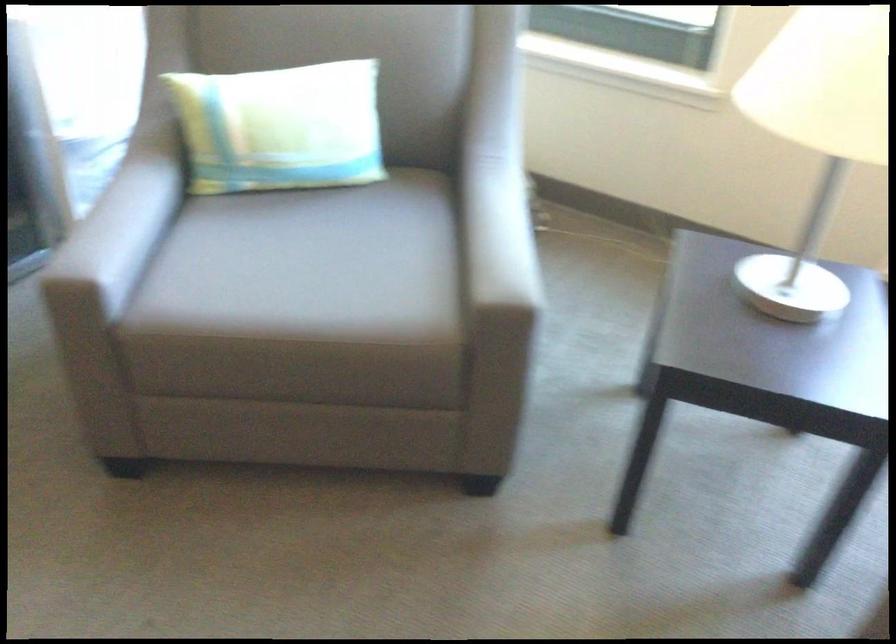
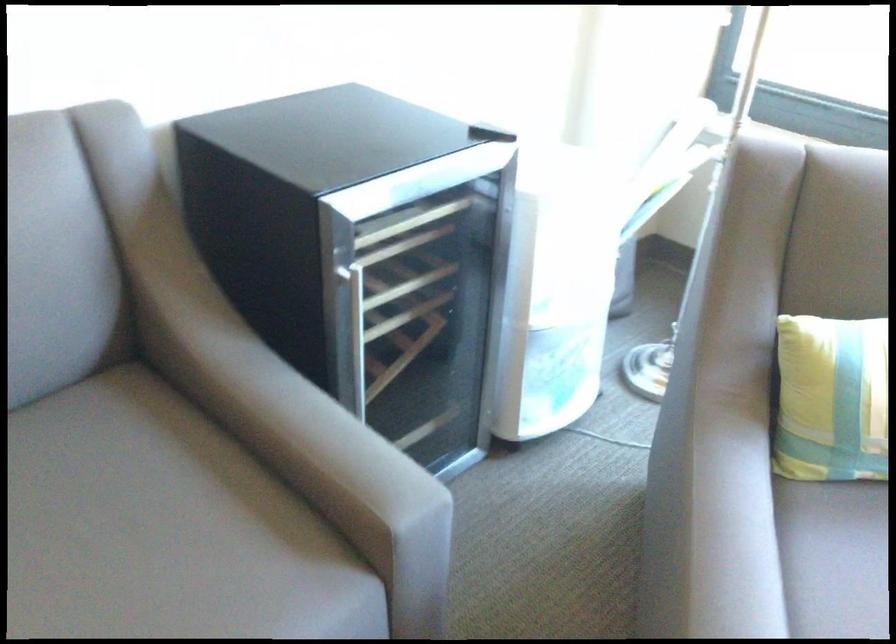
The point at (195, 124) is marked in the first image. Where is the corresponding point in the second image?

(831, 399)